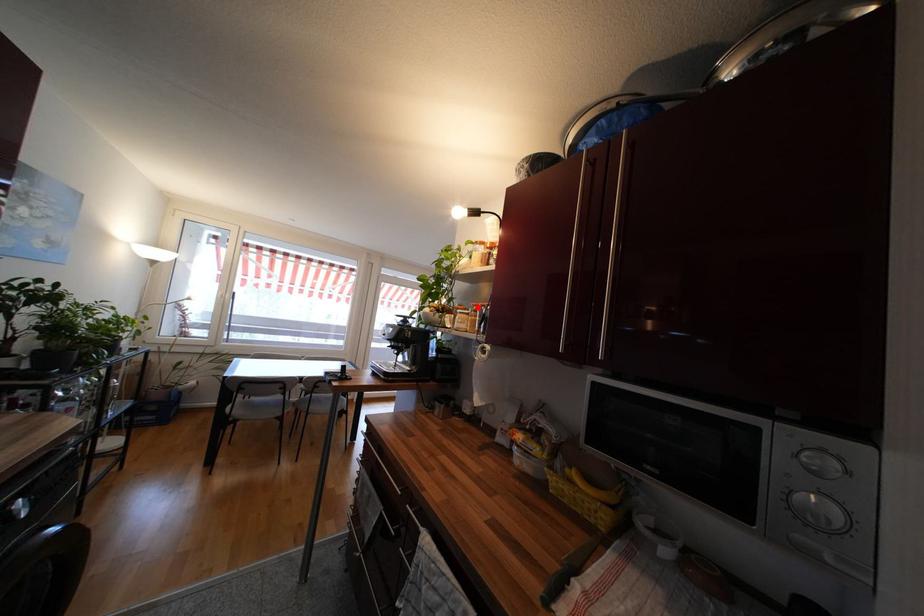
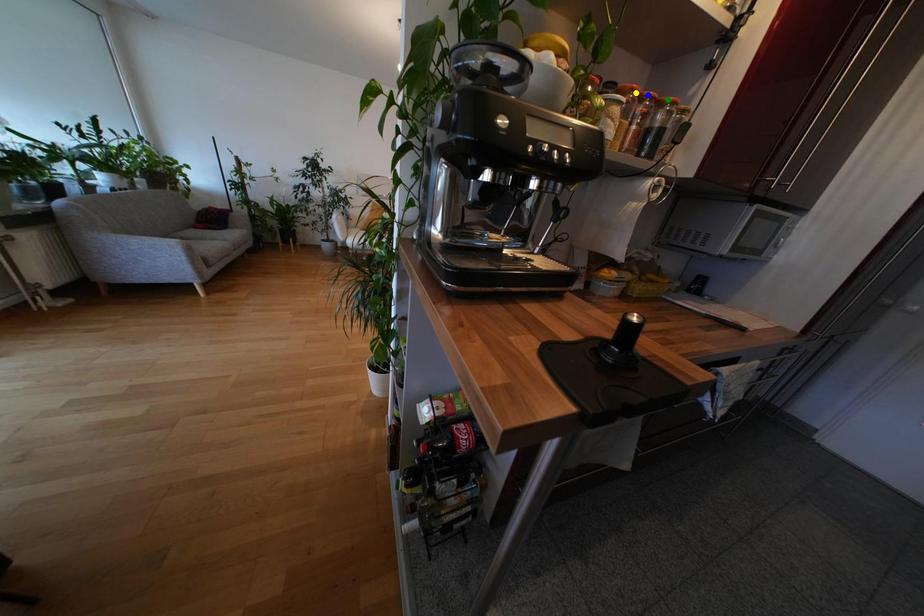
Question: I am providing you with two images of the same scene from different viewpoints. A red point is marked on the first image. You are given multiple points on the second image. In image 2, which mark is for the same physical point as the one in image 1?

Choices:
 (A) green point
 (B) yellow point
 (C) blue point

Answer: (B)